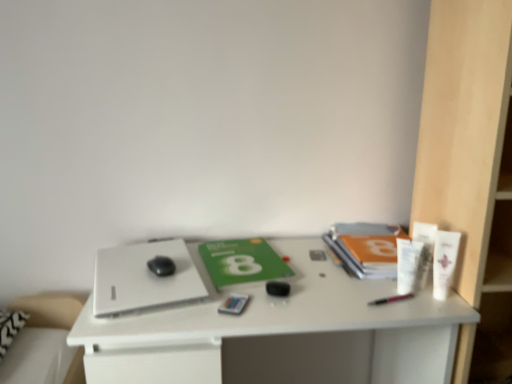
Identify the location of free region on the left part of white plastic tube at right, the second toiletry in the left-to-right sequence. The width and height of the screenshot is (512, 384). (352, 286).